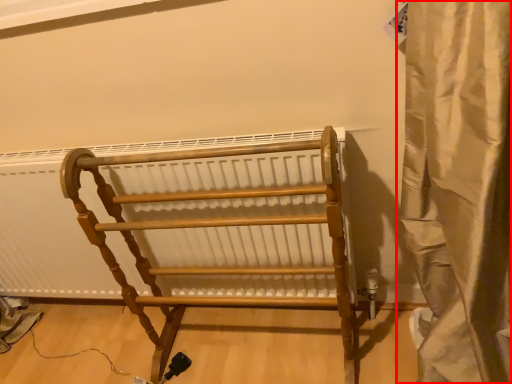
Question: From the image's perspective, what is the correct spatial relationship of curtain (annotated by the red box) in relation to furniture?

Choices:
 (A) below
 (B) above

Answer: (B)